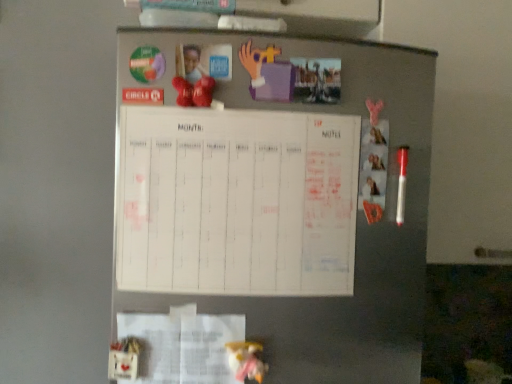
Question: Is pink paper at right situated inside white fabric doll at lower center or outside?

Choices:
 (A) outside
 (B) inside

Answer: (A)

Question: From a real-world perspective, is pink paper at right above or below white fabric doll at lower center?

Choices:
 (A) below
 (B) above

Answer: (B)

Question: Based on their relative distances, which object is nearer to the white fabric doll at lower center?

Choices:
 (A) pink paper at right
 (B) white paperboard at center
 (C) white paper at lower left

Answer: (C)

Question: Which of these objects is positioned closest to the white paperboard at center?

Choices:
 (A) white fabric doll at lower center
 (B) pink paper at right
 (C) white paper at lower left

Answer: (C)